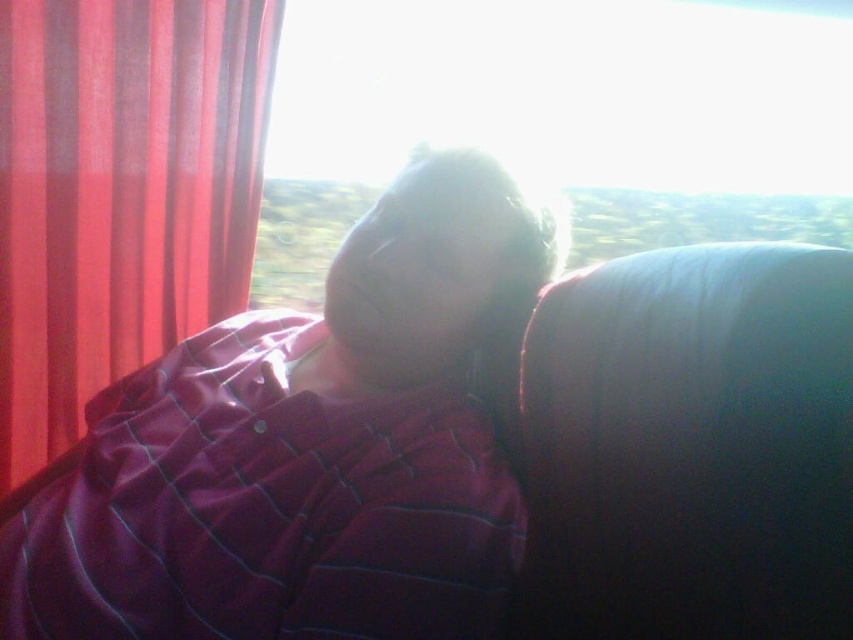
Does suede-like dark brown couch at right have a greater width compared to velvet-like red curtain at left?

No.

Image resolution: width=853 pixels, height=640 pixels. Describe the element at coordinates (689, 448) in the screenshot. I see `suede-like dark brown couch at right` at that location.

You are a GUI agent. You are given a task and a screenshot of the screen. Output one action in this format:
    pyautogui.click(x=<x>, y=<y>)
    Task: Click on the suede-like dark brown couch at right
    
    Given the screenshot: What is the action you would take?
    pyautogui.click(x=689, y=448)

Does suede-like dark brown couch at right have a greater height compared to transparent glass at upper center?

No, suede-like dark brown couch at right is not taller than transparent glass at upper center.

Does suede-like dark brown couch at right appear on the right side of transparent glass at upper center?

In fact, suede-like dark brown couch at right is to the left of transparent glass at upper center.

Locate an element on the screen. The height and width of the screenshot is (640, 853). suede-like dark brown couch at right is located at coordinates (689, 448).

Does maroon plaid shirt at center have a smaller size compared to transparent glass at upper center?

Indeed, maroon plaid shirt at center has a smaller size compared to transparent glass at upper center.

Is maroon plaid shirt at center thinner than transparent glass at upper center?

Indeed, maroon plaid shirt at center has a lesser width compared to transparent glass at upper center.

This screenshot has width=853, height=640. I want to click on maroon plaid shirt at center, so click(306, 449).